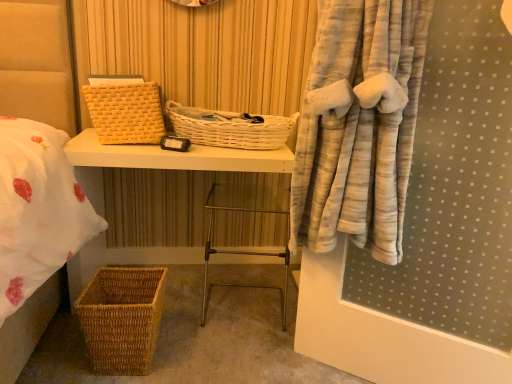
Question: Do you think woven wicker basket at lower left is within white wicker basket at center, the 2th basket in the top-to-bottom sequence, or outside of it?

Choices:
 (A) inside
 (B) outside

Answer: (B)

Question: From the image's perspective, is woven wicker basket at lower left above or below white wicker basket at center, which is the 2th basket in bottom-to-top order?

Choices:
 (A) below
 (B) above

Answer: (A)

Question: Considering the real-world distances, which object is closest to the yellow woven basket at upper left, the first basket viewed from the top?

Choices:
 (A) white wicker basket at center, which is the 2th basket in bottom-to-top order
 (B) woven brown basket at lower left, placed as the first basket when sorted from bottom to top
 (C) woven wicker basket at lower left
 (D) metallic silver step stool at center

Answer: (C)

Question: Which object is positioned farthest from the white wicker basket at center, the 2th basket in the top-to-bottom sequence?

Choices:
 (A) metallic silver step stool at center
 (B) yellow woven basket at upper left, which is the 3th basket from bottom to top
 (C) woven brown basket at lower left, placed as the first basket when sorted from bottom to top
 (D) woven wicker basket at lower left

Answer: (C)